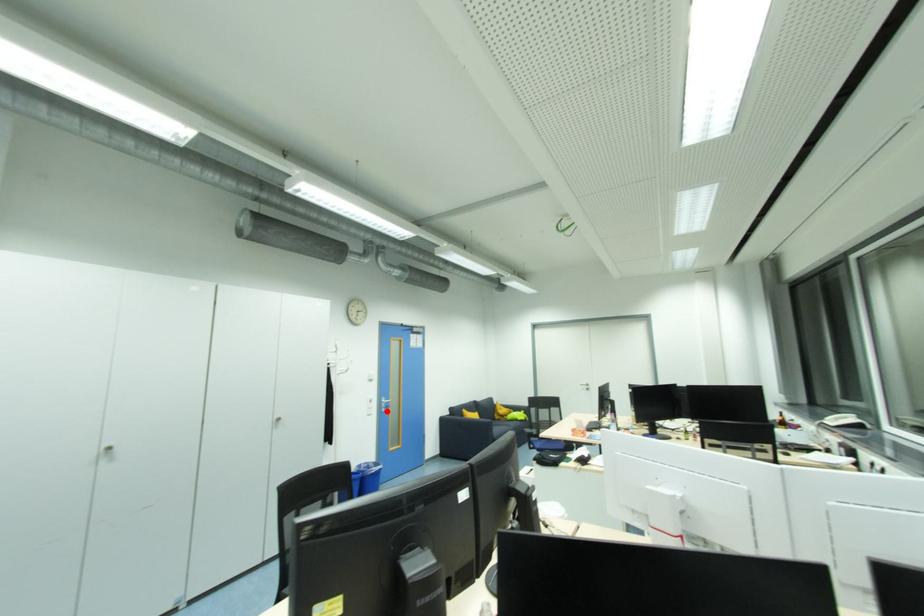
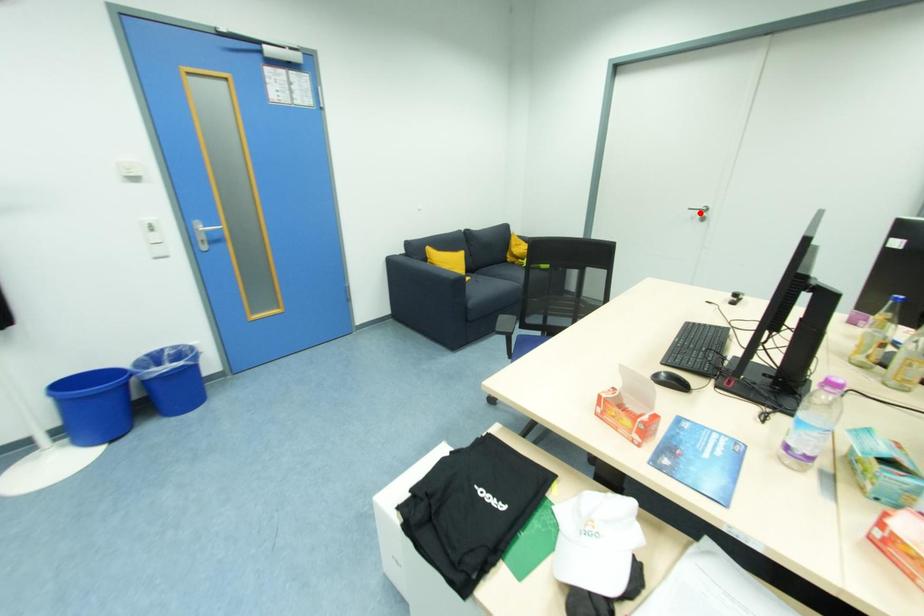
I am providing you with two images of the same scene from different viewpoints. A red point is marked on the first image and another point is marked on the second image. Is the red point in image1 aligned with the point shown in image2?

No